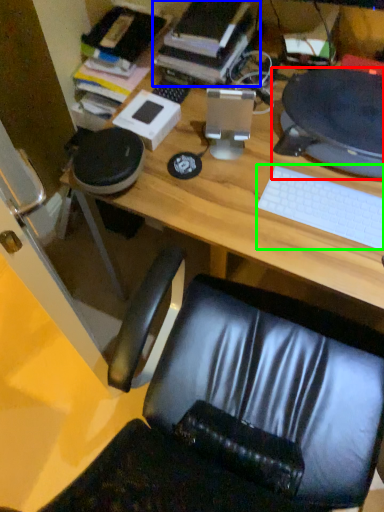
Question: Estimate the real-world distances between objects in this image. Which object is closer to desktop computer (highlighted by a red box), book (highlighted by a blue box) or keyboard (highlighted by a green box)?

Choices:
 (A) book
 (B) keyboard

Answer: (B)